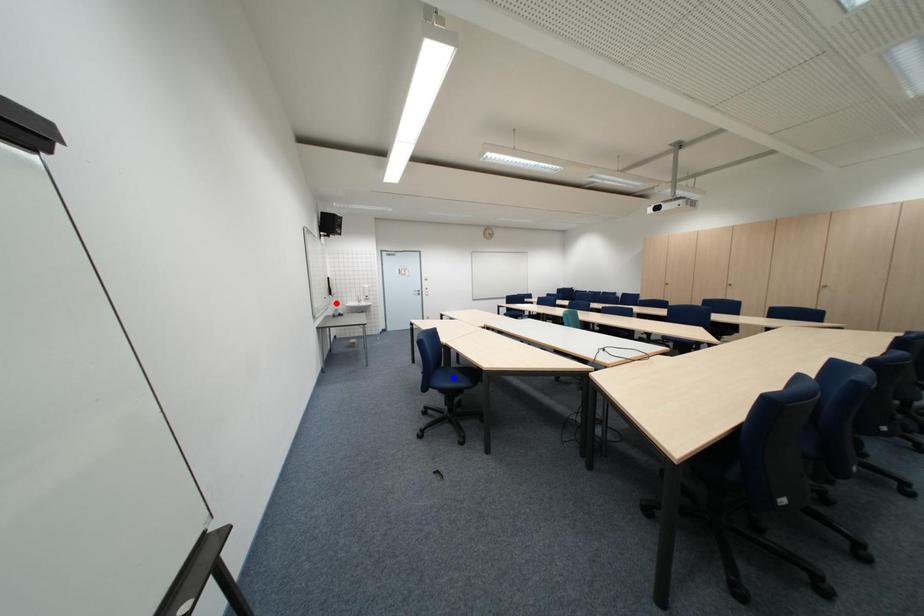
Question: In the image, two points are highlighted. Which point is nearer to the camera? Reply with the corresponding letter.

Choices:
 (A) blue point
 (B) red point

Answer: (A)